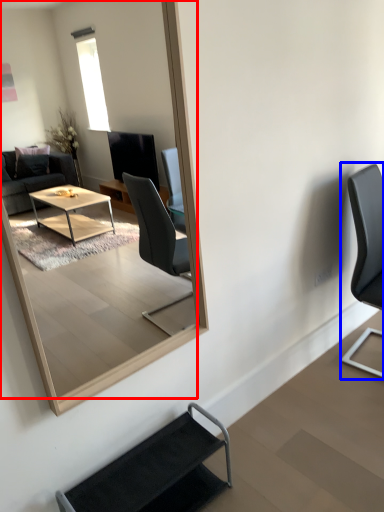
Question: Which of the following is the farthest to the observer, mirror (highlighted by a red box) or chair (highlighted by a blue box)?

Choices:
 (A) mirror
 (B) chair

Answer: (B)